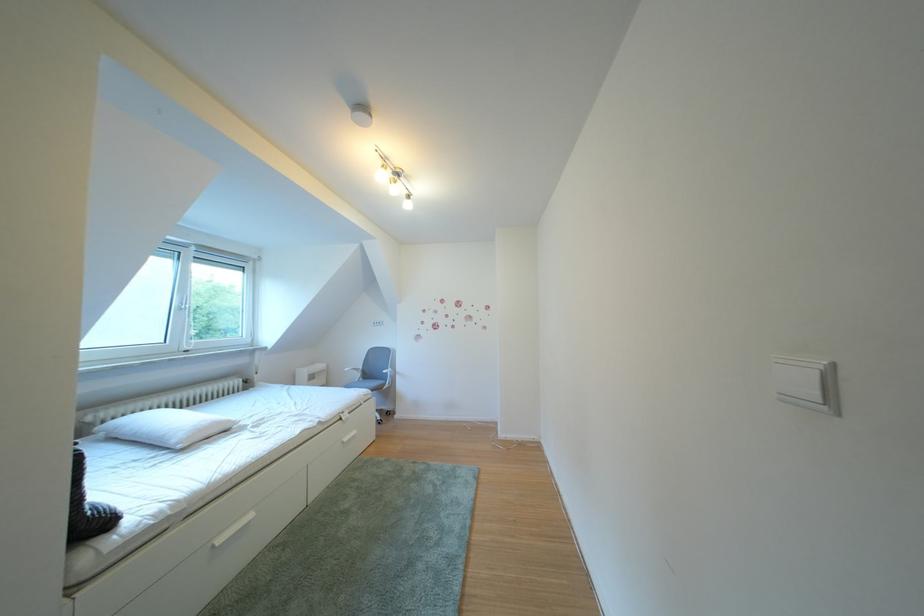
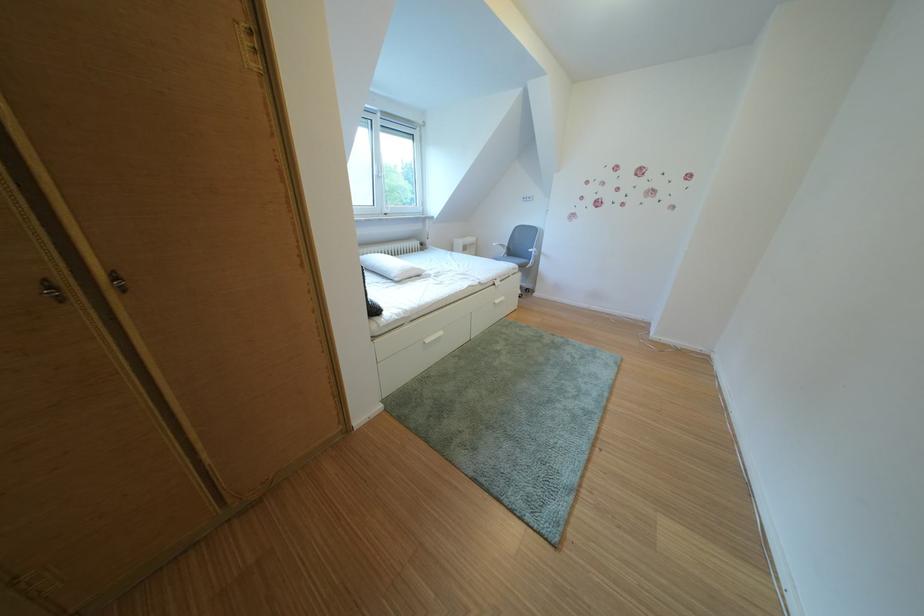
Where in the second image is the point corresponding to point (359, 445) from the first image?

(511, 307)